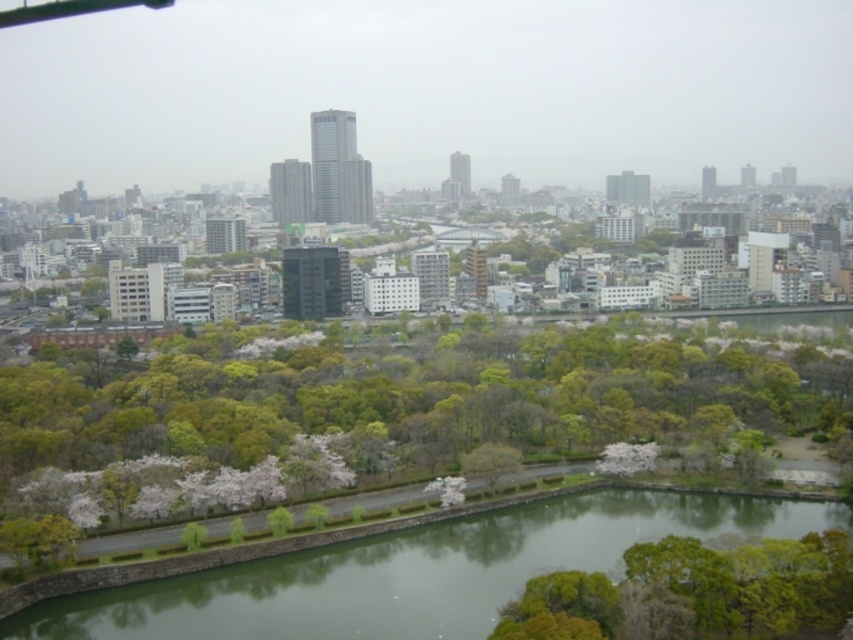
You are standing at the observation deck of the building and want to take a photo that includes both the point at coordinate point (13,513) and the point at coordinate point (599,518). Which point will appear closer to the edge of the photo frame?

Point (13,513) is closer to the viewer than point (599,518), so it will appear closer to the edge of the photo frame.

You are a city planner analyzing the space between the green leafy tree at center and the green smooth water at center. If you want to place a bench here, would it be possible to fit a bench that is 2 meters wide between them?

The green leafy tree at center might be wider than green smooth water at center, so the space between them may not be sufficient to fit a 2 meter wide bench. Further measurements are needed to confirm.

You are a city planner analyzing the cityscape. You need to determine which object, the green leafy tree at center or the green smooth water at center, is taller. Based on the scene, which one is taller?

The green leafy tree at center is taller than the green smooth water at center according to the description provided.